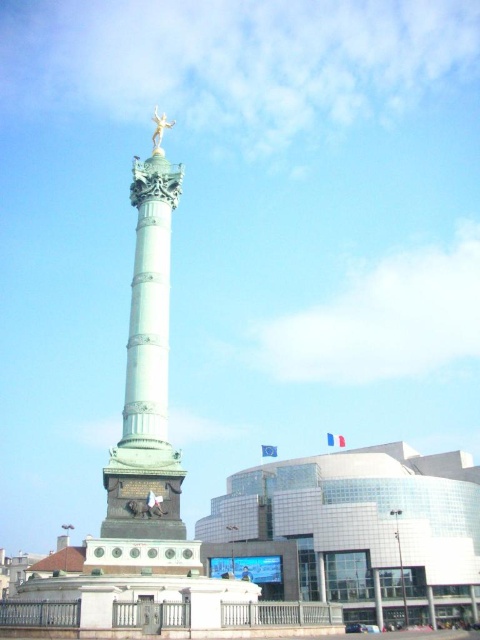
Who is more distant from viewer, (x=158, y=368) or (x=156, y=128)?

The point (x=156, y=128) is more distant.

Is point (156, 532) closer to viewer compared to point (163, 118)?

Yes, point (156, 532) is in front of point (163, 118).

Which is in front, point (153, 192) or point (156, 140)?

Point (153, 192)

Identify the location of bronze/golden column at center. (146, 372).